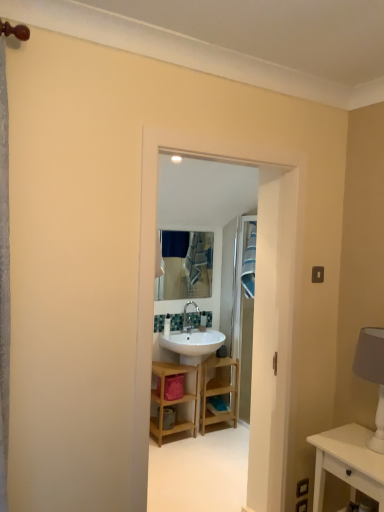
Find the location of a particular element. The image size is (384, 512). free space in front of wooden shelf at center is located at coordinates (213, 441).